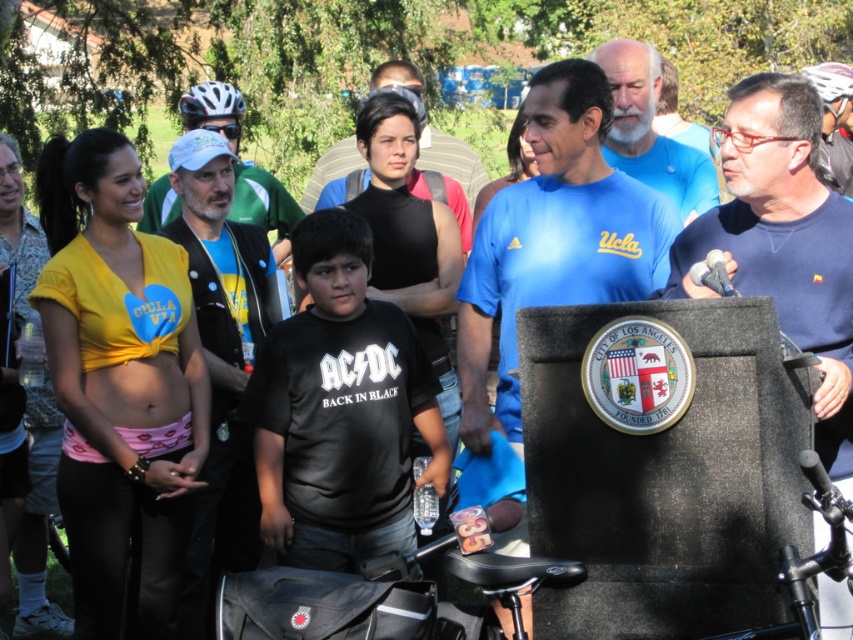
Question: Does black matte shirt at center have a smaller size compared to white matte bicycle helmet at upper left?

Choices:
 (A) no
 (B) yes

Answer: (A)

Question: Is matte black vest at center further to the viewer compared to pink fabric belly at center?

Choices:
 (A) no
 (B) yes

Answer: (B)

Question: Estimate the real-world distances between objects in this image. Which object is farther from the pink fabric belly at center?

Choices:
 (A) white matte bicycle helmet at upper left
 (B) matte black vest at center

Answer: (A)

Question: Estimate the real-world distances between objects in this image. Which object is closer to the blue fabric shirt at center?

Choices:
 (A) pink fabric belly at center
 (B) matte black vest at center
 (C) black matte shirt at center
 (D) white matte bicycle helmet at upper left

Answer: (A)

Question: Which object is closer to the camera taking this photo?

Choices:
 (A) matte black vest at center
 (B) black matte shirt at center
 (C) blue fabric shirt at center
 (D) shiny silver helmet at upper right

Answer: (C)

Question: Is yellow fabric shirt at left thinner than matte black helmet at upper left?

Choices:
 (A) yes
 (B) no

Answer: (A)